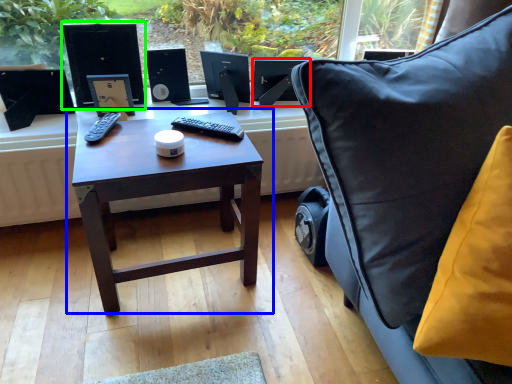
Question: Which object is the closest to the computer monitor (highlighted by a red box)? Choose among these: table (highlighted by a blue box) or desktop computer (highlighted by a green box).

Choices:
 (A) table
 (B) desktop computer

Answer: (B)